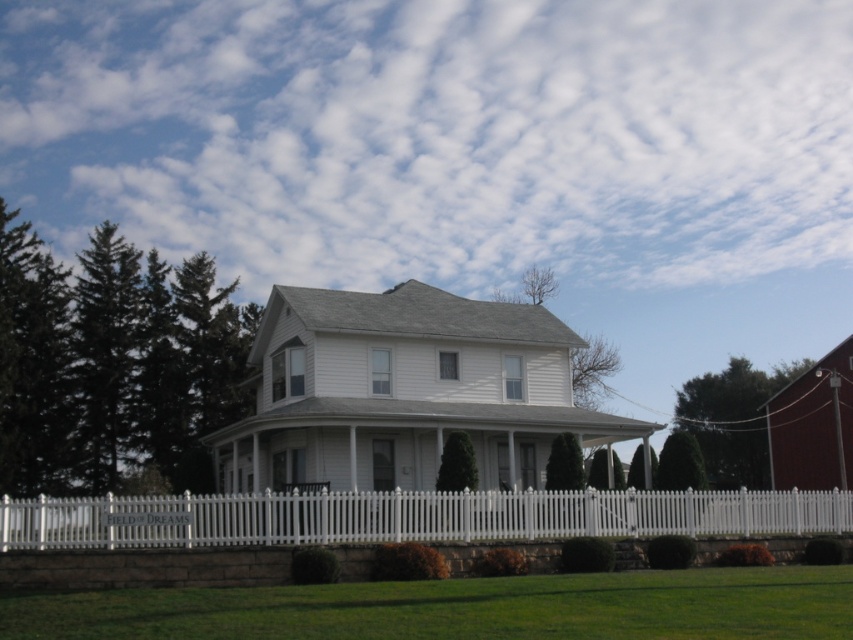
You are standing in front of the house and want to walk towards the green grass at lower center and the white picket fence at lower center. Which one will you step on first?

You will step on the green grass at lower center first because it is closer to you than the white picket fence at lower center.

You are standing in front of the house and want to take a photo. You notice two points marked in the scene. The first point is at coordinate point[520,448] and the second is at point[297,604]. Which point is closer to your camera?

Point[297,604] is closer to the camera than point[520,448].

You are standing at the front yard of the house and want to walk towards the white wood barn at center. Which direction should you walk relative to the green grass at lower center?

You should walk towards the white wood barn at center, which is positioned over the green grass at lower center, so you would walk in the direction of the green grass at lower center to reach it.